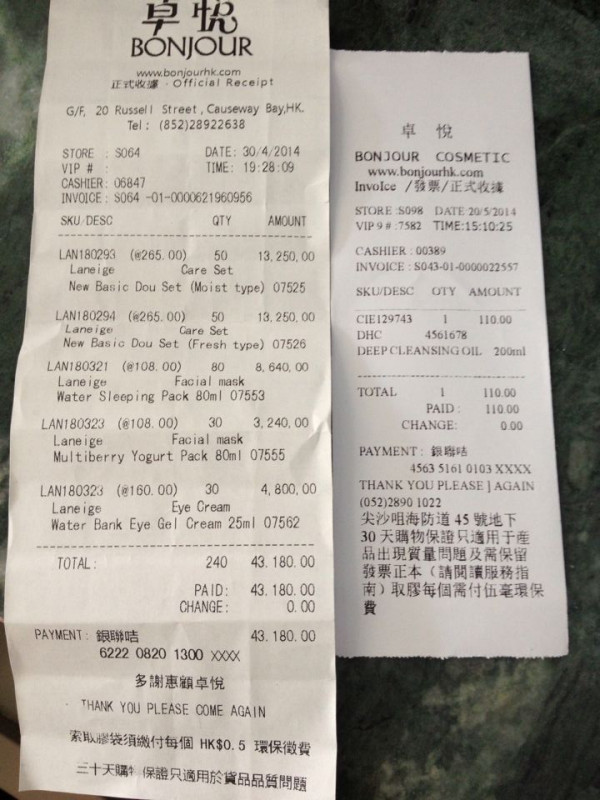
The width and height of the screenshot is (600, 800). I want to click on corner, so [x=568, y=654], [x=525, y=54], [x=18, y=790].